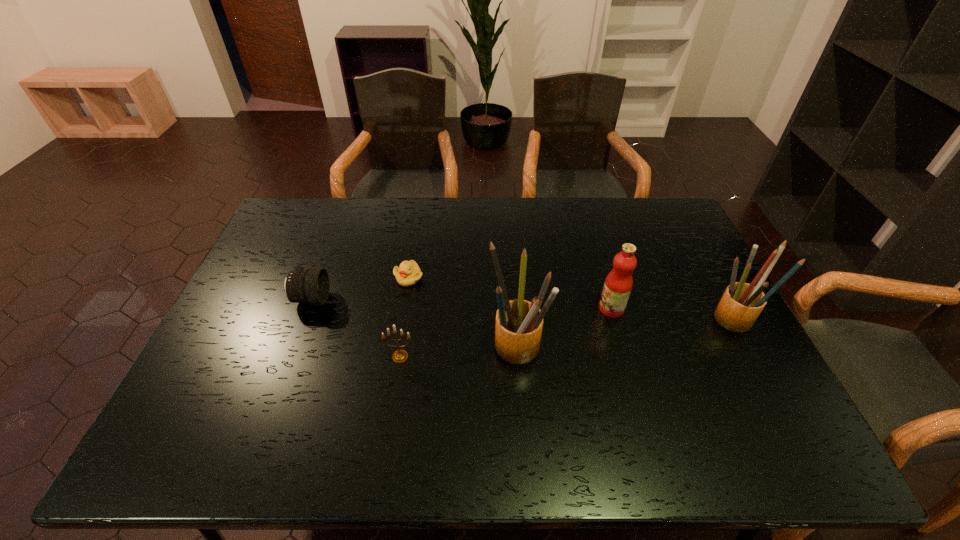
Identify the location of vacant region between the shortest object and the candelabrum. 404,317.

This screenshot has width=960, height=540. I want to click on object identified as the third closest to the telephoto lens, so click(x=519, y=323).

Image resolution: width=960 pixels, height=540 pixels. I want to click on object identified as the closest to the left pencil box, so click(618, 284).

Identify the location of vacant region that satisfies the following two spatial constraints: 1. at the front element of the candelabrum; 2. on the left side of the leftmost object. The image size is (960, 540). (290, 356).

Identify the location of free region that satisfies the following two spatial constraints: 1. at the face of the duckling; 2. at the front element of the second shortest object. (405, 300).

This screenshot has width=960, height=540. In order to click on vacant region that satisfies the following two spatial constraints: 1. on the back side of the right pencil box; 2. on the front label of the second object from right to left in this screenshot , I will do `click(730, 309)`.

Locate an element on the screen. This screenshot has height=540, width=960. vacant point that satisfies the following two spatial constraints: 1. at the front element of the leftmost object; 2. on the right side of the right pencil box is located at coordinates (302, 322).

Locate an element on the screen. The width and height of the screenshot is (960, 540). free space that satisfies the following two spatial constraints: 1. at the face of the right pencil box; 2. on the left side of the shortest object is located at coordinates (401, 322).

The width and height of the screenshot is (960, 540). I want to click on free point that satisfies the following two spatial constraints: 1. on the front label of the second object from right to left; 2. on the front side of the tallest object, so click(x=622, y=347).